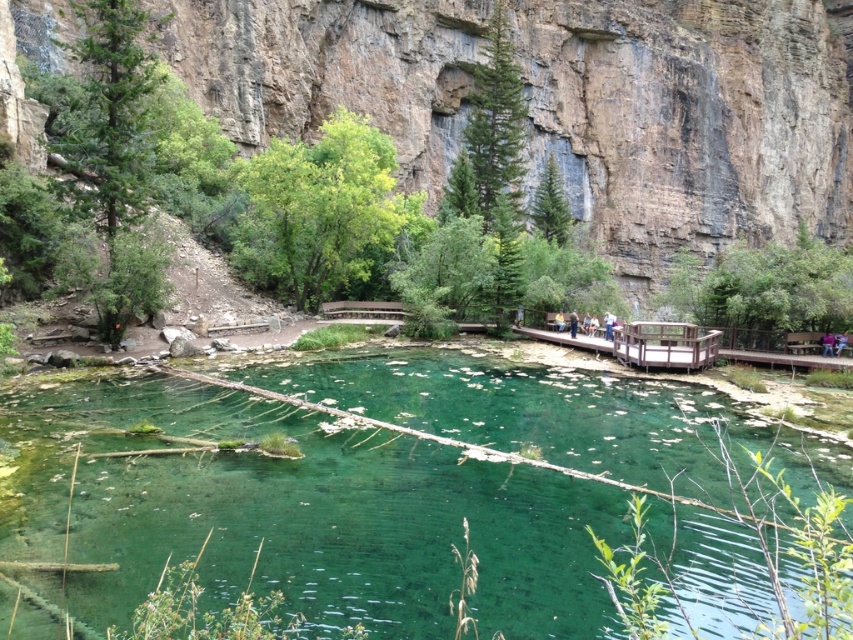
Question: Which object appears farthest from the camera in this image?

Choices:
 (A) green translucent water at center
 (B) brown rock canyon at center

Answer: (B)

Question: Does green translucent water at center appear on the left side of brown rock canyon at center?

Choices:
 (A) yes
 (B) no

Answer: (A)

Question: Can you confirm if green translucent water at center is positioned to the right of brown rock canyon at center?

Choices:
 (A) no
 (B) yes

Answer: (A)

Question: Among these points, which one is farthest from the camera?

Choices:
 (A) coord(428,454)
 (B) coord(734,141)

Answer: (B)

Question: Considering the relative positions of green translucent water at center and brown rock canyon at center in the image provided, where is green translucent water at center located with respect to brown rock canyon at center?

Choices:
 (A) above
 (B) below

Answer: (B)